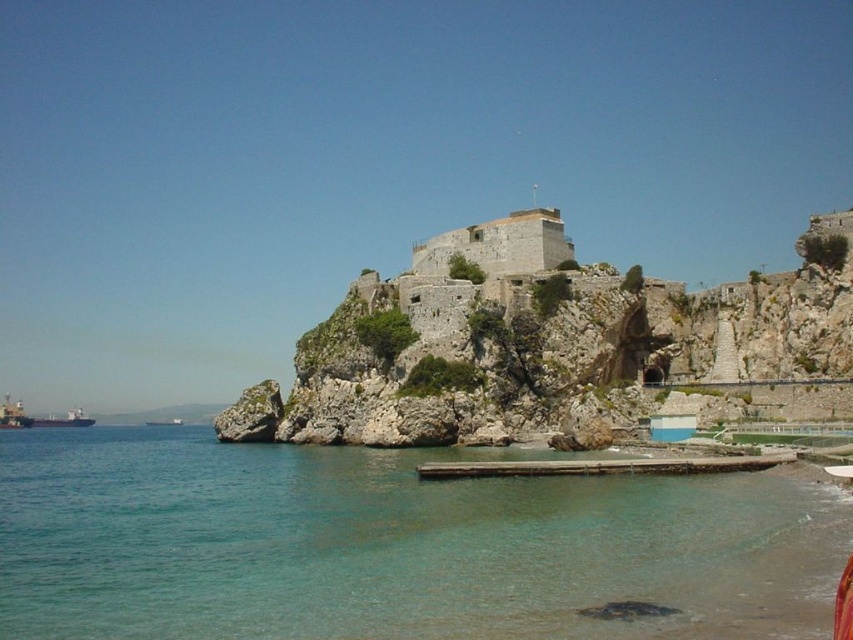
Is point (312, 609) behind point (165, 424)?

No, it is not.

Is clear water at lower left thinner than metallic gray ship at left?

No.

Does point (85, 452) lie behind point (173, 426)?

No, it is not.

The width and height of the screenshot is (853, 640). I want to click on clear water at lower left, so click(372, 541).

Between green matte cargo ship at lower left and metallic gray ship at left, which one is positioned lower?

Positioned lower is metallic gray ship at left.

Does point (74, 406) come farther from viewer compared to point (155, 424)?

Yes, it is.

Is point (86, 426) less distant than point (169, 420)?

Yes, it is in front of point (169, 420).

You are a GUI agent. You are given a task and a screenshot of the screen. Output one action in this format:
    pyautogui.click(x=<x>, y=<y>)
    Task: Click on the green matte cargo ship at lower left
    The image size is (853, 640).
    Given the screenshot: What is the action you would take?
    pyautogui.click(x=64, y=419)

Does clear water at lower left have a lesser height compared to green matte cargo ship at lower left?

Incorrect, clear water at lower left's height does not fall short of green matte cargo ship at lower left's.

The width and height of the screenshot is (853, 640). What do you see at coordinates (372, 541) in the screenshot?
I see `clear water at lower left` at bounding box center [372, 541].

Measure the distance between clear water at lower left and camera.

clear water at lower left is 41.41 meters from camera.

You are a GUI agent. You are given a task and a screenshot of the screen. Output one action in this format:
    pyautogui.click(x=<x>, y=<y>)
    Task: Click on the clear water at lower left
    The image size is (853, 640).
    Given the screenshot: What is the action you would take?
    pyautogui.click(x=372, y=541)